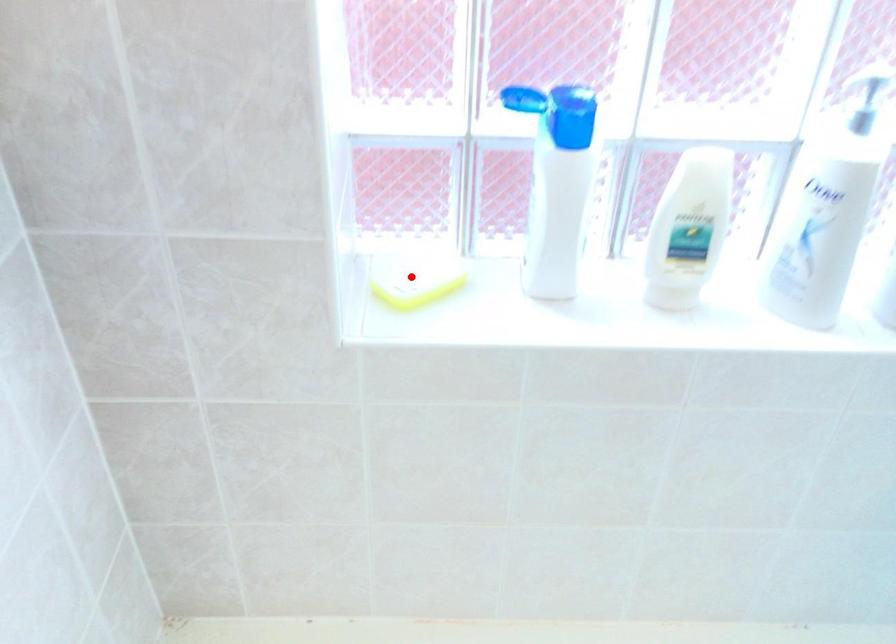
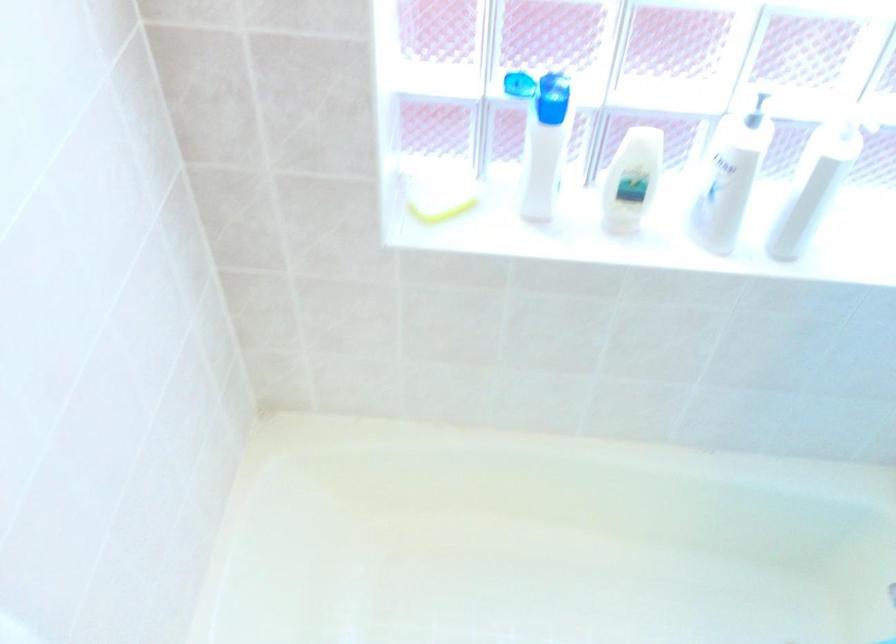
Question: A red point is marked in image1. In image2, is the corresponding 3D point closer to the camera or farther? Reply with the corresponding letter.

Choices:
 (A) The corresponding 3D point is closer.
 (B) The corresponding 3D point is farther.

Answer: (B)